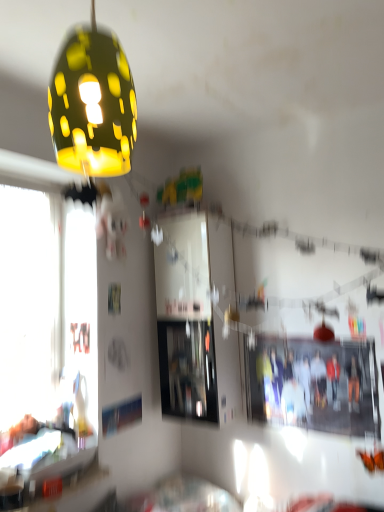
Question: Could you tell me if matte black photo at center is turned towards matte yellow lampshade at upper left?

Choices:
 (A) no
 (B) yes

Answer: (A)

Question: Are matte black photo at center and matte yellow lampshade at upper left making contact?

Choices:
 (A) yes
 (B) no

Answer: (B)

Question: Is matte black photo at center wider than matte yellow lampshade at upper left?

Choices:
 (A) yes
 (B) no

Answer: (B)

Question: Does matte black photo at center have a smaller size compared to matte yellow lampshade at upper left?

Choices:
 (A) no
 (B) yes

Answer: (B)

Question: Is matte black photo at center to the right of matte yellow lampshade at upper left from the viewer's perspective?

Choices:
 (A) no
 (B) yes

Answer: (B)

Question: From a real-world perspective, does matte black photo at center sit lower than matte yellow lampshade at upper left?

Choices:
 (A) yes
 (B) no

Answer: (A)

Question: Is matte yellow lampshade at upper left closer to camera compared to matte black photo at center?

Choices:
 (A) yes
 (B) no

Answer: (A)

Question: Is matte yellow lampshade at upper left thinner than matte black photo at center?

Choices:
 (A) no
 (B) yes

Answer: (A)

Question: Is matte yellow lampshade at upper left smaller than matte black photo at center?

Choices:
 (A) no
 (B) yes

Answer: (A)

Question: Is matte yellow lampshade at upper left oriented towards matte black photo at center?

Choices:
 (A) yes
 (B) no

Answer: (B)

Question: Is matte yellow lampshade at upper left beside matte black photo at center?

Choices:
 (A) yes
 (B) no

Answer: (B)

Question: Is matte yellow lampshade at upper left to the left of matte black photo at center from the viewer's perspective?

Choices:
 (A) no
 (B) yes

Answer: (B)

Question: Is point (89, 162) positioned closer to the camera than point (377, 387)?

Choices:
 (A) closer
 (B) farther

Answer: (A)